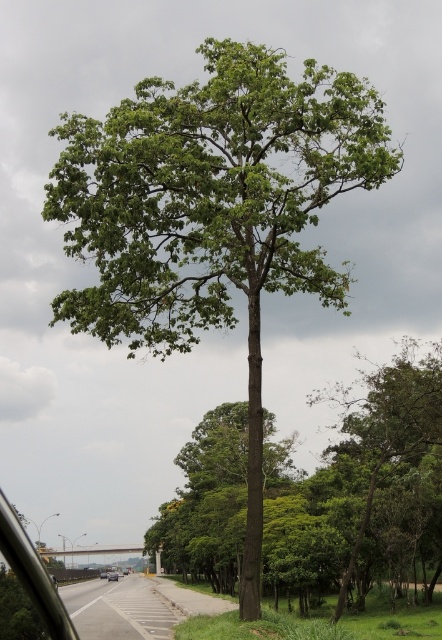
Can you confirm if asphalt road at lower left is positioned to the right of transparent glass car window at lower left?

No, asphalt road at lower left is not to the right of transparent glass car window at lower left.

Locate an element on the screen. The width and height of the screenshot is (442, 640). asphalt road at lower left is located at coordinates (118, 609).

Identify the location of green leafy tree at center. The image size is (442, 640). (361, 488).

Is green leafy tree at center taller than transparent glass car window at lower left?

Yes, green leafy tree at center is taller than transparent glass car window at lower left.

Is point (350, 538) less distant than point (53, 621)?

No, (350, 538) is behind (53, 621).

At what (x,y) coordinates should I click in order to perform the action: click on green leafy tree at center. Please return your answer as a coordinate pair (x, y). The height and width of the screenshot is (640, 442). Looking at the image, I should click on (361, 488).

Between asphalt road at lower left and silver metallic car at center, which one appears on the right side from the viewer's perspective?

Positioned to the right is asphalt road at lower left.

Looking at this image, between asphalt road at lower left and silver metallic car at center, which one is positioned higher?

asphalt road at lower left is above.

Does point (119, 580) come farther from viewer compared to point (103, 570)?

No, (119, 580) is closer to viewer.

What are the coordinates of `asphalt road at lower left` in the screenshot? It's located at (118, 609).